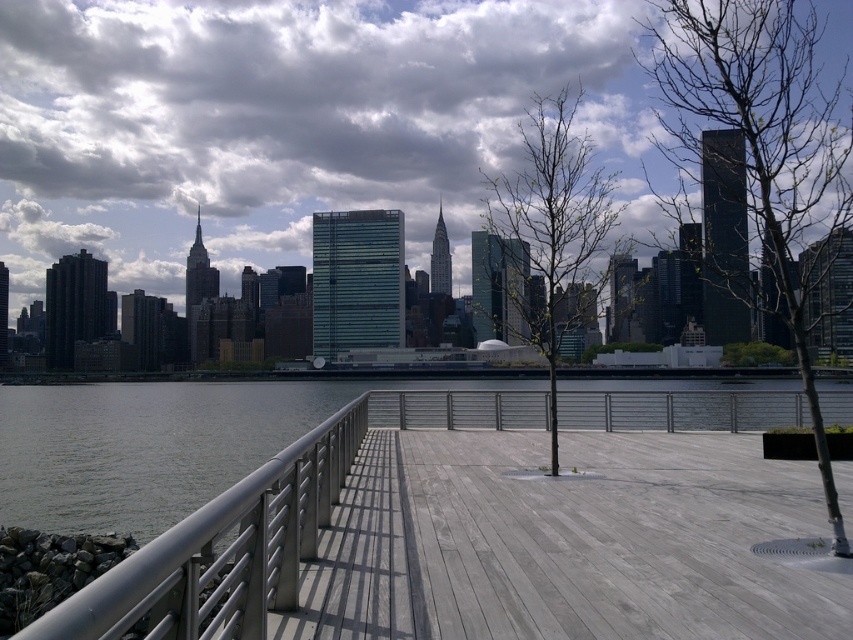
Question: Does smooth gray wood deck at center have a greater width compared to bare wood tree at center?

Choices:
 (A) no
 (B) yes

Answer: (A)

Question: Which of the following is the closest to the observer?

Choices:
 (A) (549, 412)
 (B) (677, 76)
 (C) (160, 563)

Answer: (C)

Question: Based on their relative distances, which object is farther from the smooth gray wood deck at center?

Choices:
 (A) green leafy tree at center
 (B) bare wood tree at center

Answer: (A)

Question: Observing the image, what is the correct spatial positioning of bare wood tree at center in reference to green leafy tree at center?

Choices:
 (A) below
 (B) above

Answer: (B)

Question: Which point appears closest to the camera in this image?

Choices:
 (A) (541, 160)
 (B) (175, 554)

Answer: (B)

Question: In this image, where is bare wood tree at center located relative to green leafy tree at center?

Choices:
 (A) below
 (B) above

Answer: (B)